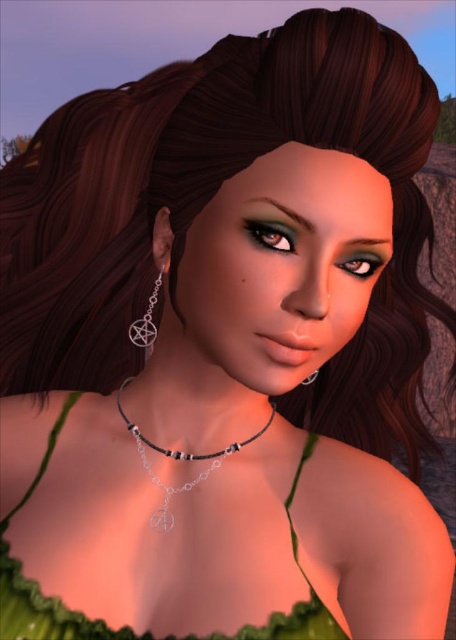
You are a fashion designer who needs to decide whether to pair a green fabric dress at center with a silver metallic pentagram at center. Based on their sizes, will the pentagram pendant be visible when worn with the dress?

The green fabric dress at center is bigger than the silver metallic pentagram at center, so the pentagram pendant will be visible as it is smaller and can stand out against the larger dress.

From the picture: You are a photographer standing in front of the green fabric dress at center. You want to take a closeup shot of the dress. What is the minimum distance you need to maintain to capture the entire dress in the frame?

The minimum distance to maintain is 14.73 inches because the green fabric dress at center and viewer are 14.73 inches apart.

You are a fashion designer who wants to ensure the pendant of the silver metallic pentagram at center is visible when the person is wearing the green fabric dress at center. Based on their positions, will the pendant be visible?

The green fabric dress at center is positioned under the silver metallic pentagram at center, so the pendant will be visible as it is placed above the dress.